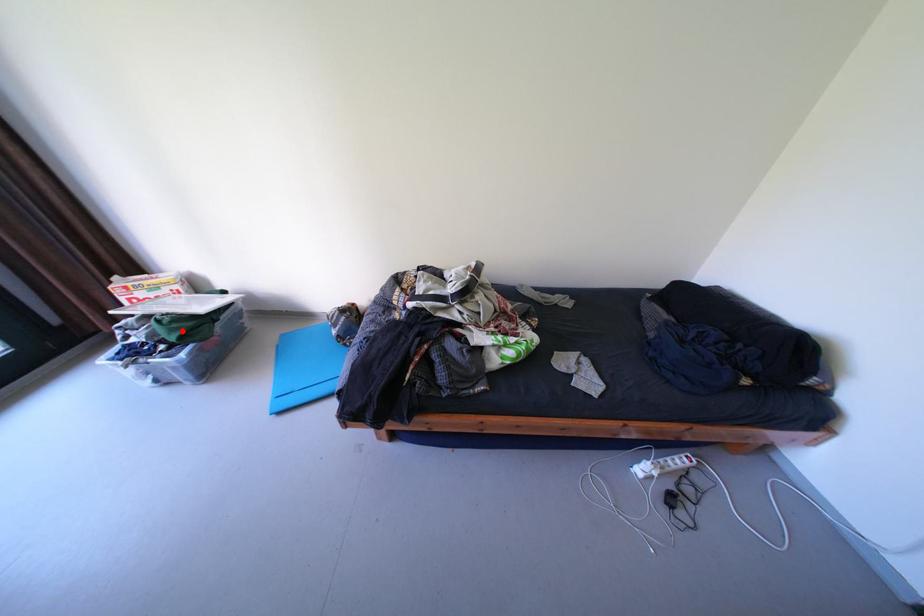
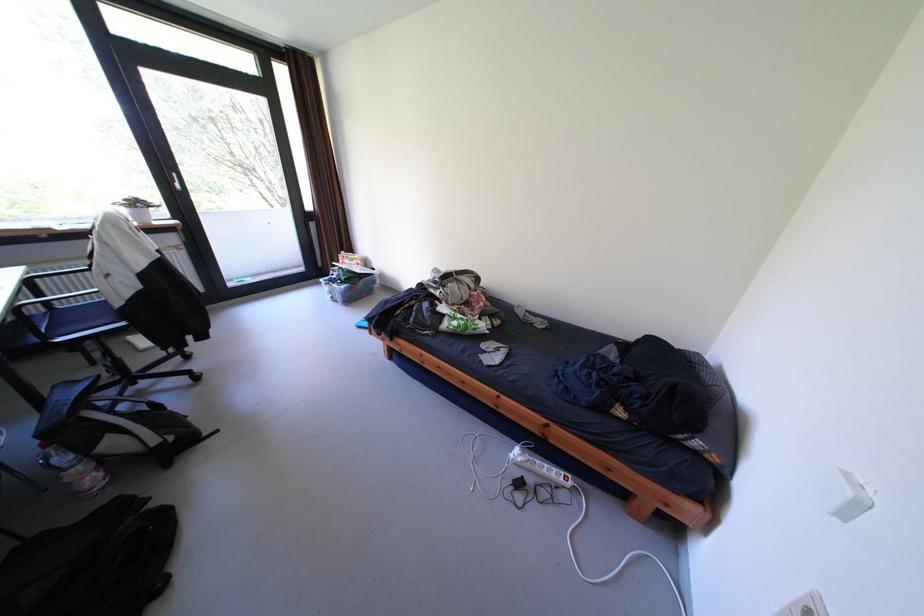
Where in the second image is the point corresponding to the highlighted location from the first image?

(355, 275)